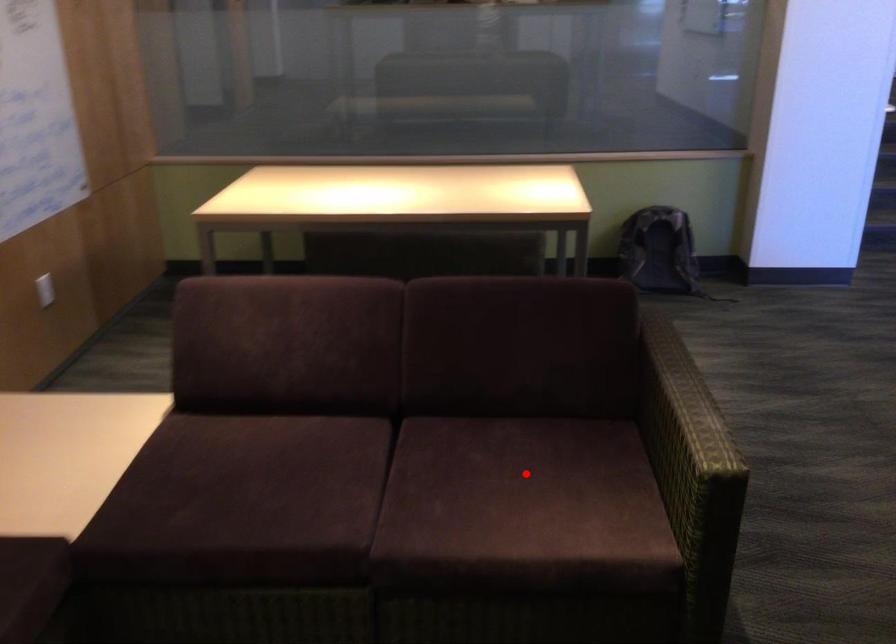
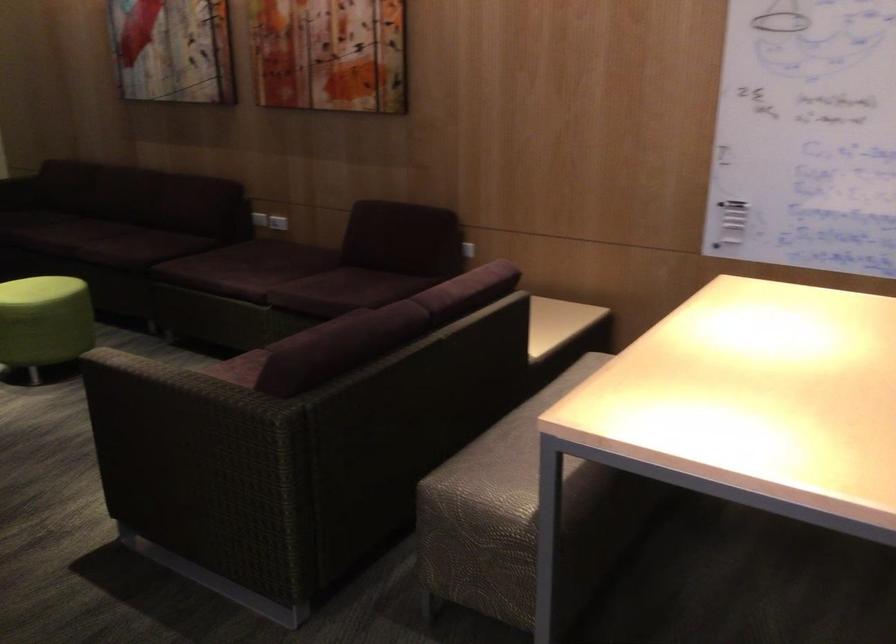
Question: I am providing you with two images of the same scene from different viewpoints. A red point is marked on the first image. At the location where the point appears in image 1, is it still visible in image 2?

Choices:
 (A) Yes
 (B) No

Answer: (B)